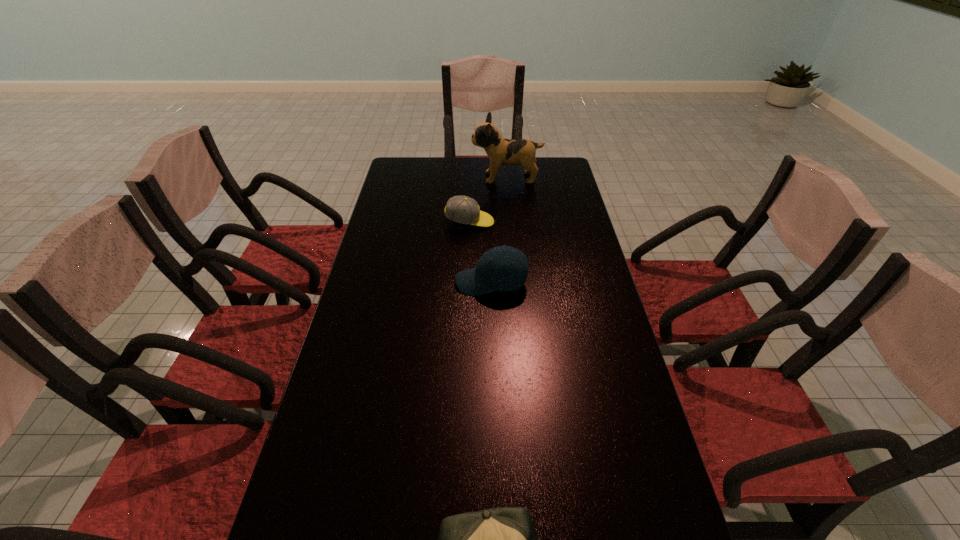
Locate an element on the screen. The image size is (960, 540). the tallest object is located at coordinates (499, 150).

Locate an element on the screen. the farthest object is located at coordinates (499, 150).

At what (x,y) coordinates should I click in order to perform the action: click on the third farthest object. Please return your answer as a coordinate pair (x, y). Looking at the image, I should click on pos(503,268).

Find the location of a particular element. The height and width of the screenshot is (540, 960). the second farthest baseball cap is located at coordinates (503, 268).

Find the location of a particular element. the farthest baseball cap is located at coordinates (462, 209).

The image size is (960, 540). Identify the location of free spot located at the face of the puppy. (393, 178).

Where is `free location located at the face of the puppy`? This screenshot has height=540, width=960. free location located at the face of the puppy is located at coordinates (407, 178).

Identify the location of vacant space located at the face of the puppy. This screenshot has width=960, height=540. (428, 178).

In order to click on free space located 0.290m on the front-facing side of the second farthest baseball cap in this screenshot , I will do `click(361, 282)`.

The width and height of the screenshot is (960, 540). In order to click on free space located 0.280m on the front-facing side of the second farthest baseball cap in this screenshot , I will do `click(365, 282)`.